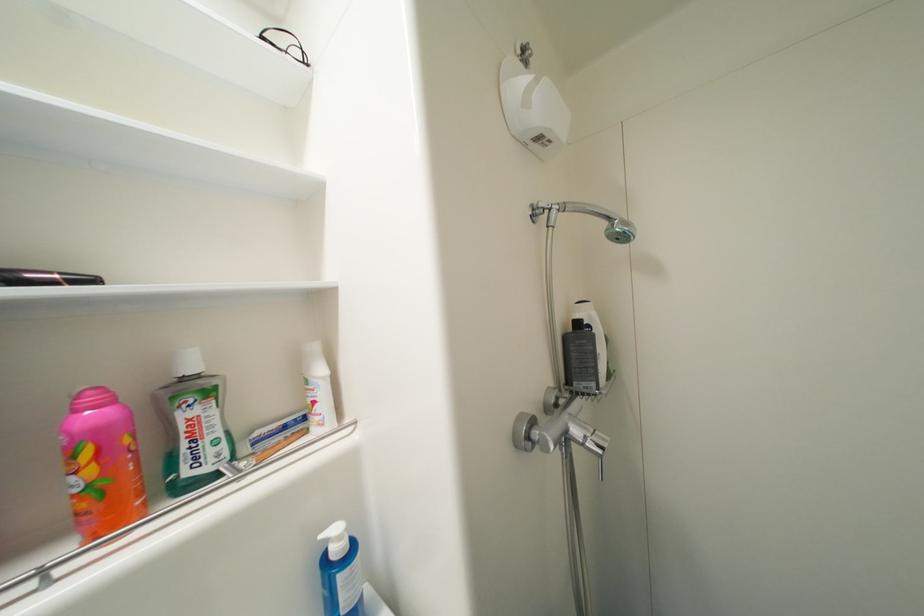
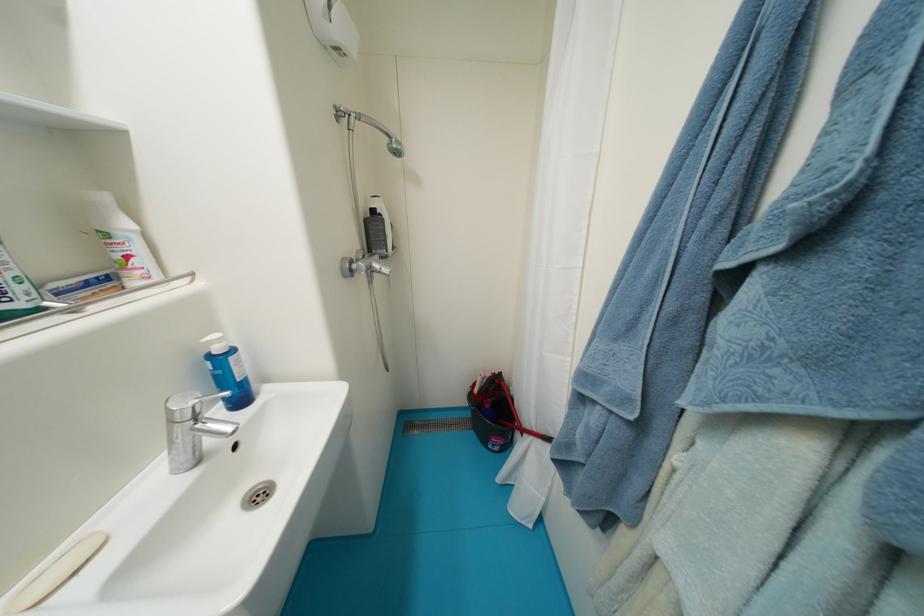
Locate, in the second image, the point that corresponds to point 346,540 in the first image.

(225, 342)